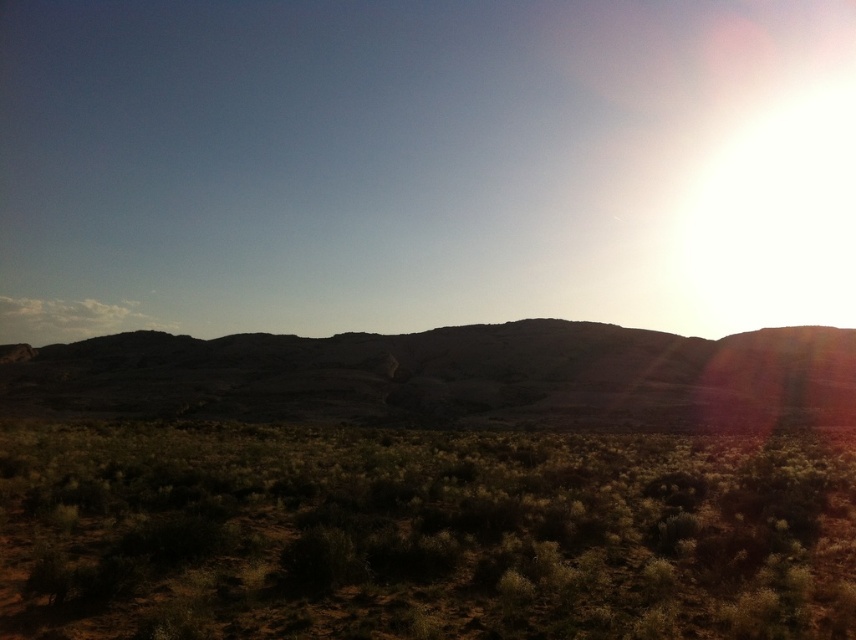
Question: Is green shrubbery at lower center bigger than dull brown rock at center?

Choices:
 (A) yes
 (B) no

Answer: (B)

Question: Is green shrubbery at lower center thinner than dull brown rock at center?

Choices:
 (A) yes
 (B) no

Answer: (A)

Question: Does green shrubbery at lower center have a larger size compared to dull brown rock at center?

Choices:
 (A) no
 (B) yes

Answer: (A)

Question: Which point appears closest to the camera in this image?

Choices:
 (A) (308, 404)
 (B) (556, 624)

Answer: (B)